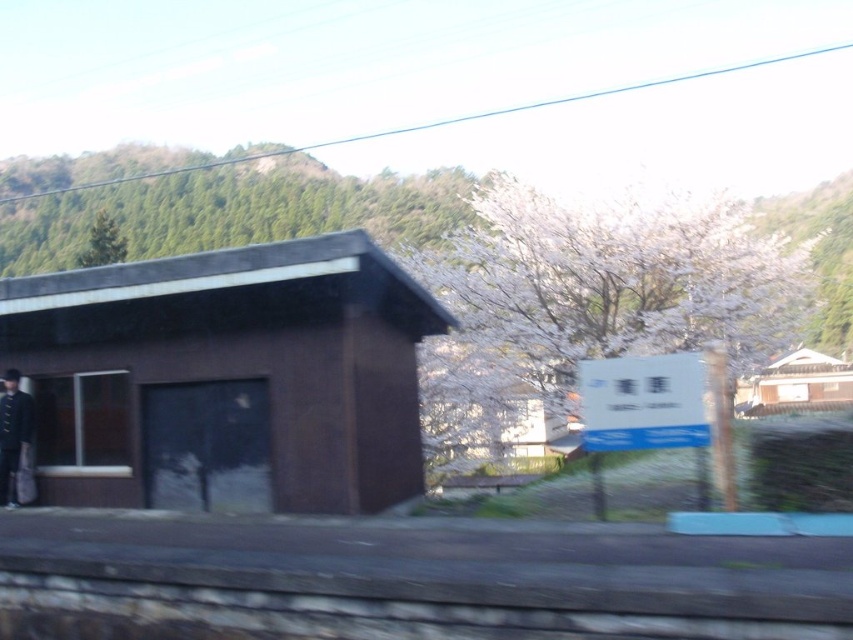
Between brown matte hut at left and white wooden house at upper right, which one appears on the left side from the viewer's perspective?

Positioned to the left is brown matte hut at left.

Which is in front, point (198, 499) or point (792, 378)?

Point (198, 499) is in front.

Is point (271, 282) behind point (834, 378)?

No, it is in front of (834, 378).

Find the location of a particular element. brown matte hut at left is located at coordinates (227, 378).

Can you confirm if white wooden house at upper right is positioned below dark brown leather coat at left?

Yes, white wooden house at upper right is below dark brown leather coat at left.

Can you confirm if white wooden house at upper right is taller than dark brown leather coat at left?

Yes, white wooden house at upper right is taller than dark brown leather coat at left.

Which is behind, point (762, 413) or point (26, 426)?

Point (762, 413)

At what (x,y) coordinates should I click in order to perform the action: click on white wooden house at upper right. Please return your answer as a coordinate pair (x, y). The width and height of the screenshot is (853, 640). Looking at the image, I should click on (799, 384).

Does brown matte hut at left lie behind dark brown leather coat at left?

No, brown matte hut at left is closer to the viewer.

Who is higher up, brown matte hut at left or dark brown leather coat at left?

brown matte hut at left is higher up.

Is point (157, 346) farther from camera compared to point (7, 465)?

No, (157, 346) is in front of (7, 465).

What are the coordinates of `brown matte hut at left` in the screenshot? It's located at (227, 378).